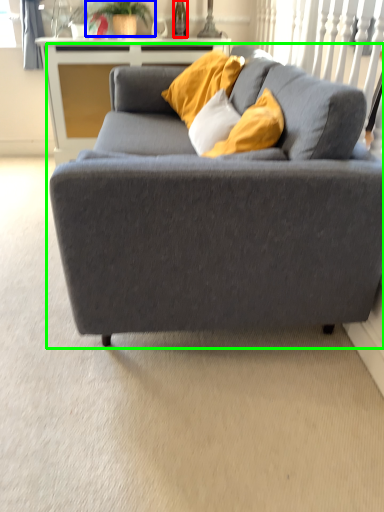
Question: Based on their relative distances, which object is nearer to wine bottle (highlighted by a red box)? Choose from plant (highlighted by a blue box) and studio couch (highlighted by a green box).

Choices:
 (A) plant
 (B) studio couch

Answer: (A)